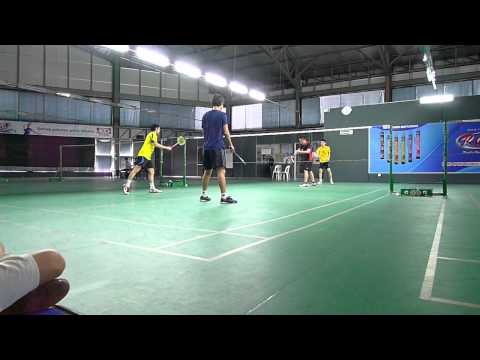
At what (x,y) coordinates should I click in order to perform the action: click on shoe. Please return your answer as a coordinate pair (x, y). This screenshot has height=360, width=480. Looking at the image, I should click on (53, 296).